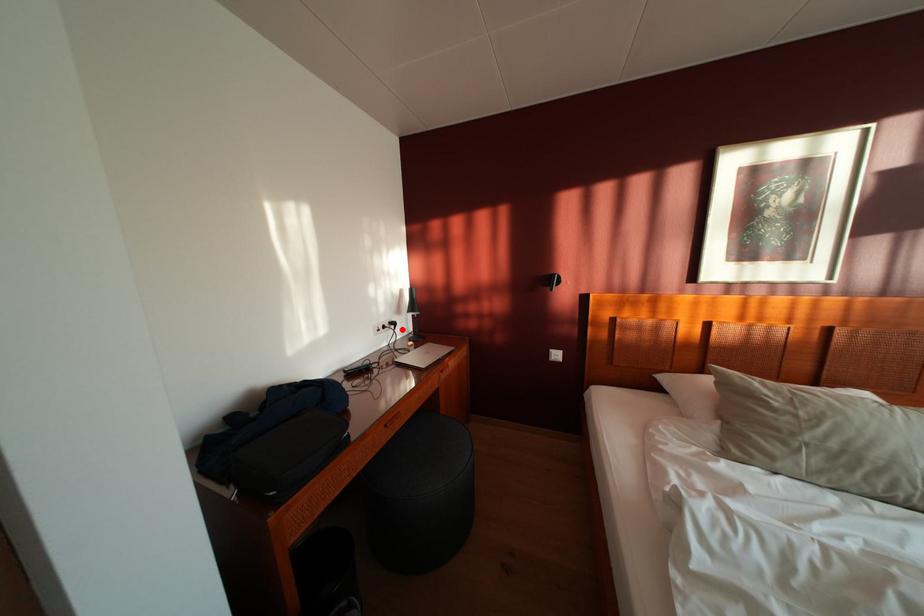
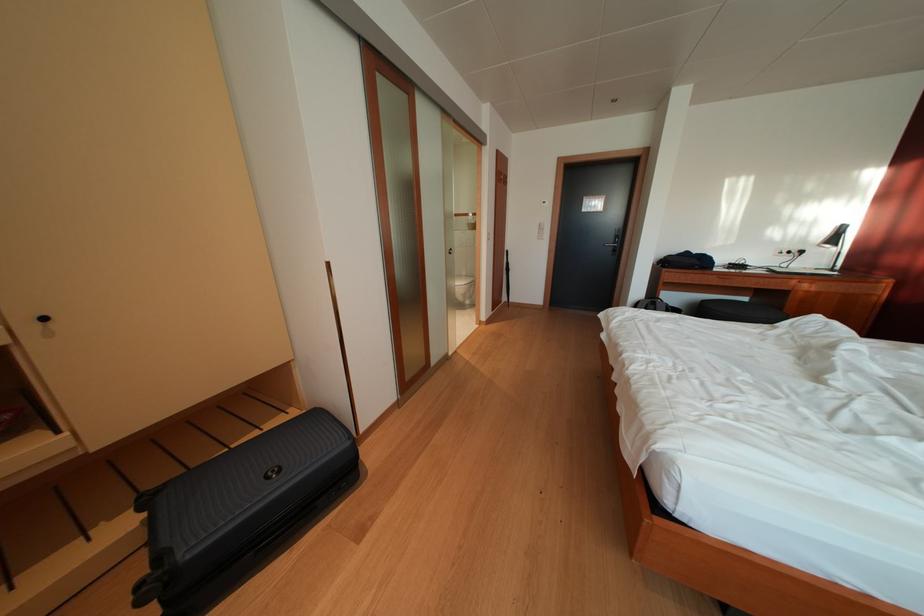
The point at the highlighted location is marked in the first image. Where is the corresponding point in the second image?

(809, 257)